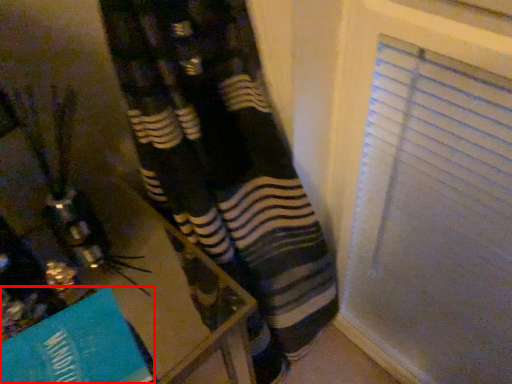
Question: In this image, where is paperback book (annotated by the red box) located relative to table?

Choices:
 (A) right
 (B) left

Answer: (B)